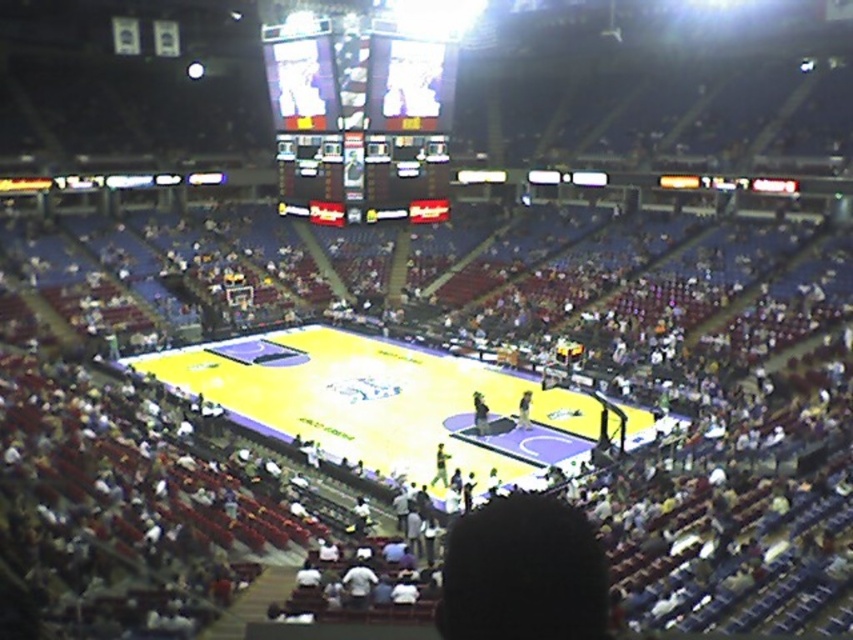
You are a photographer trying to capture the entire basketball court and the digital display in one shot. Given that your camera can only focus on objects within a 10 meter width, will the yellow polished wood court at center and the shiny digital display at upper center fit in the frame together?

The yellow polished wood court at center is bigger than the shiny digital display at upper center, so the total width required to capture both might exceed the camera focus limit of 10 meters. However, without exact measurements, it is uncertain if they will fit together.

You are a photographer standing at the back of the arena. You want to take a photo that includes both the yellow polished wood court at center and the shiny digital display at upper center. Which object should you position closer to the bottom of your camera frame?

The yellow polished wood court at center should be positioned closer to the bottom of the camera frame because it is not as tall as the shiny digital display at upper center.